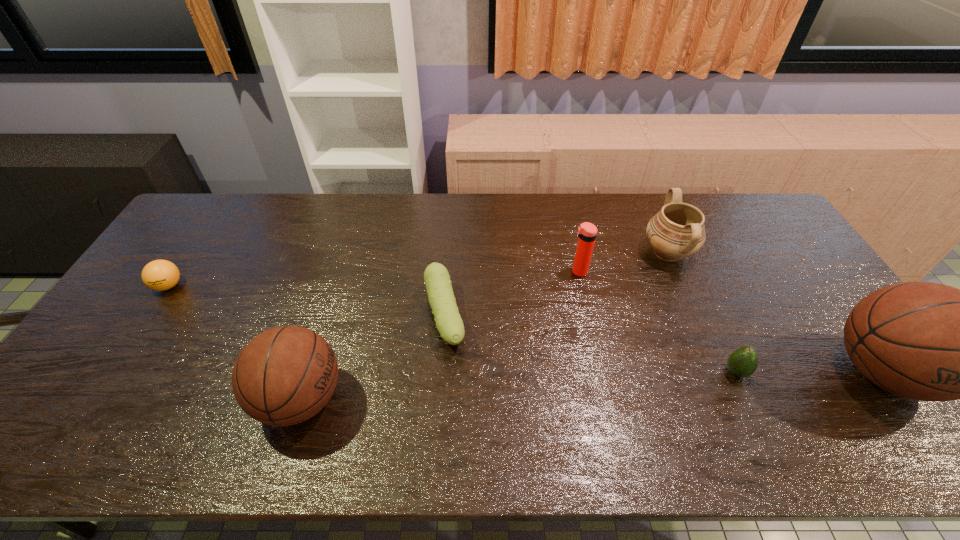
I want to click on free point between the ping-pong ball and the shorter basketball, so click(x=235, y=342).

The image size is (960, 540). What are the coordinates of `free space that is in between the ping-pong ball and the shorter basketball` in the screenshot? It's located at (235, 342).

Where is `unoccupied position between the fourth object from right to left and the leftmost object`? unoccupied position between the fourth object from right to left and the leftmost object is located at coordinates (373, 279).

In order to click on free space between the cucumber and the thermos bottle in this screenshot , I will do `click(512, 294)`.

The height and width of the screenshot is (540, 960). What are the coordinates of `free space between the avocado and the second object from left to right` in the screenshot? It's located at (518, 386).

Identify which object is the sixth nearest to the left basketball. Please provide its 2D coordinates. Your answer should be formatted as a tuple, i.e. [(x, y)], where the tuple contains the x and y coordinates of a point satisfying the conditions above.

[(925, 341)]

Locate an element on the screen. object that ranks as the fifth closest to the shorter basketball is located at coordinates (743, 362).

You are a GUI agent. You are given a task and a screenshot of the screen. Output one action in this format:
    pyautogui.click(x=<x>, y=<y>)
    Task: Click on the vacant area in the image that satisfies the following two spatial constraints: 1. on the back side of the third object from left to right; 2. on the left side of the thermos bottle
    This screenshot has height=540, width=960.
    Given the screenshot: What is the action you would take?
    pyautogui.click(x=447, y=272)

Where is `vacant area that satisfies the following two spatial constraints: 1. on the front-facing side of the urn; 2. on the back side of the avocado`? Image resolution: width=960 pixels, height=540 pixels. vacant area that satisfies the following two spatial constraints: 1. on the front-facing side of the urn; 2. on the back side of the avocado is located at coordinates (719, 372).

Identify the location of vacant space that satisfies the following two spatial constraints: 1. on the front-facing side of the avocado; 2. on the left side of the urn. Image resolution: width=960 pixels, height=540 pixels. (719, 372).